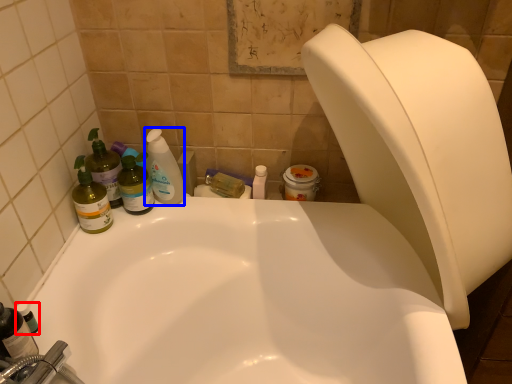
Question: Which object appears farthest to the camera in this image, toiletry (highlighted by a red box) or cleaning product (highlighted by a blue box)?

Choices:
 (A) toiletry
 (B) cleaning product

Answer: (B)